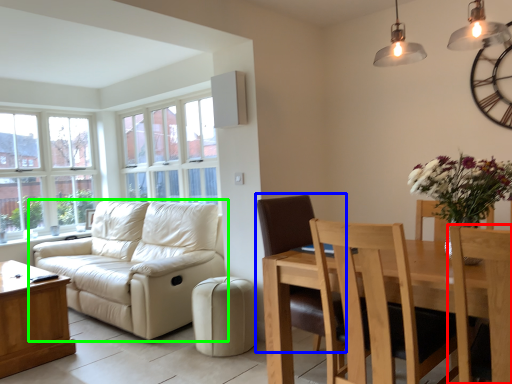
Question: Which object is the farthest from chair (highlighted by a red box)? Choose among these: chair (highlighted by a blue box) or studio couch (highlighted by a green box).

Choices:
 (A) chair
 (B) studio couch

Answer: (B)